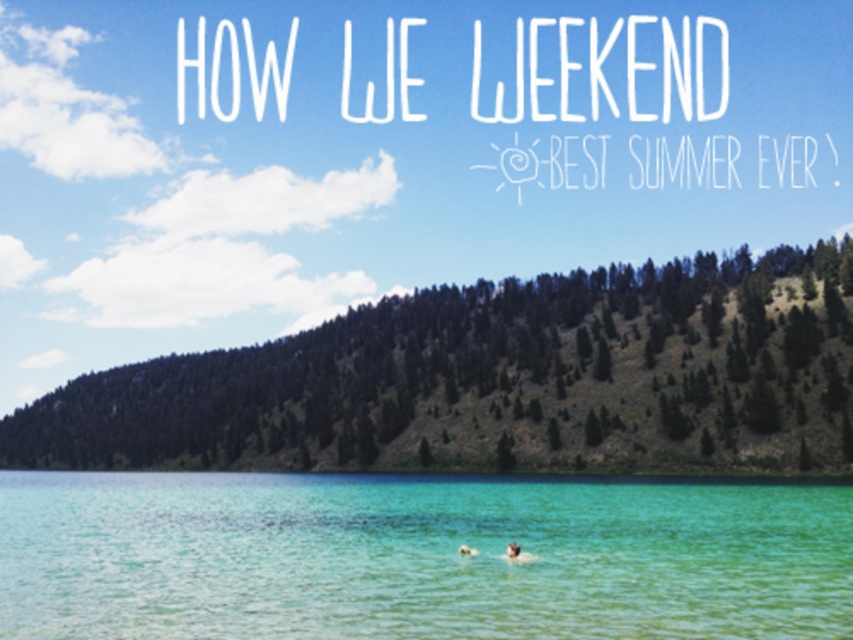
You are a photographer planning to capture a wide shot of the serene lakeside scene. You want to ensure both the clear water at center and the smooth skin person at center are visible in the frame. Based on their sizes, which object will occupy more space in the photograph?

The clear water at center will occupy more space in the photograph because its width is larger than the smooth skin person at center.

You are standing at the lakeside and want to reach a specific point marked at coordinates point [209,540]. If your swimming range is limited to 70 meters, will you be able to swim to that point?

The distance of point [209,540] from camera is 74.09 meters, so you cannot swim to that point as it exceeds your 70 meter range.